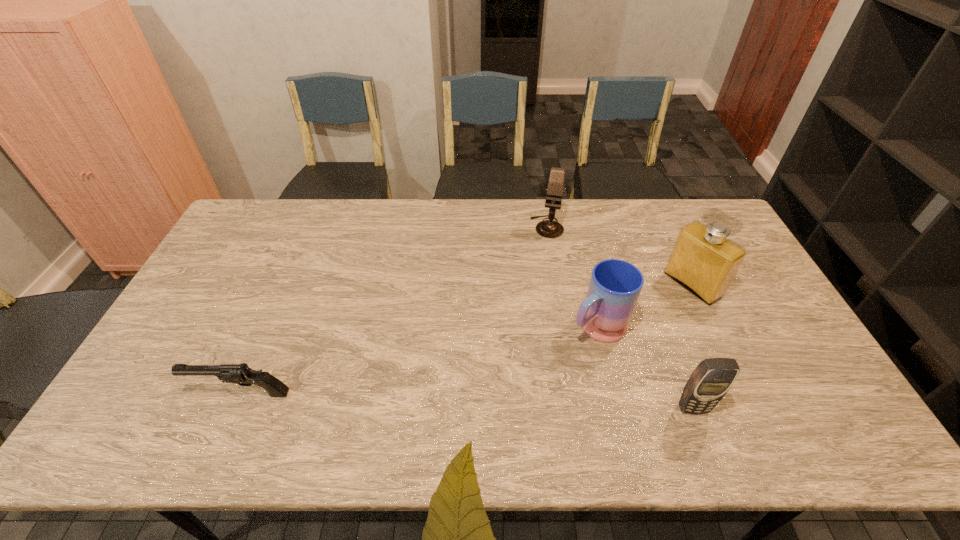
The width and height of the screenshot is (960, 540). Find the location of `vacant space located at the end of the barrel of the leftmost object`. vacant space located at the end of the barrel of the leftmost object is located at coordinates (146, 394).

At what (x,y) coordinates should I click in order to perform the action: click on free space located 0.120m on the side of the third nearest object with the handle. Please return your answer as a coordinate pair (x, y). Looking at the image, I should click on (545, 364).

Where is `free space located on the side of the third nearest object with the handle`? free space located on the side of the third nearest object with the handle is located at coordinates (537, 370).

Locate an element on the screen. free space located 0.190m on the side of the third nearest object with the handle is located at coordinates (526, 379).

Find the location of a particular element. free region located 0.350m on the front-facing side of the microphone is located at coordinates (532, 313).

Find the location of `free space located on the front-facing side of the microphone`. free space located on the front-facing side of the microphone is located at coordinates (540, 269).

Identify the location of blank area located on the front-facing side of the microphone. (534, 301).

Identify the location of vacant area situated 0.080m on the front-facing side of the rightmost object. The image size is (960, 540). (660, 308).

Identify the location of blank area located on the front-facing side of the rightmost object. The width and height of the screenshot is (960, 540). [609, 340].

Where is `free space located 0.210m on the front-facing side of the rightmost object`? Image resolution: width=960 pixels, height=540 pixels. free space located 0.210m on the front-facing side of the rightmost object is located at coordinates (629, 327).